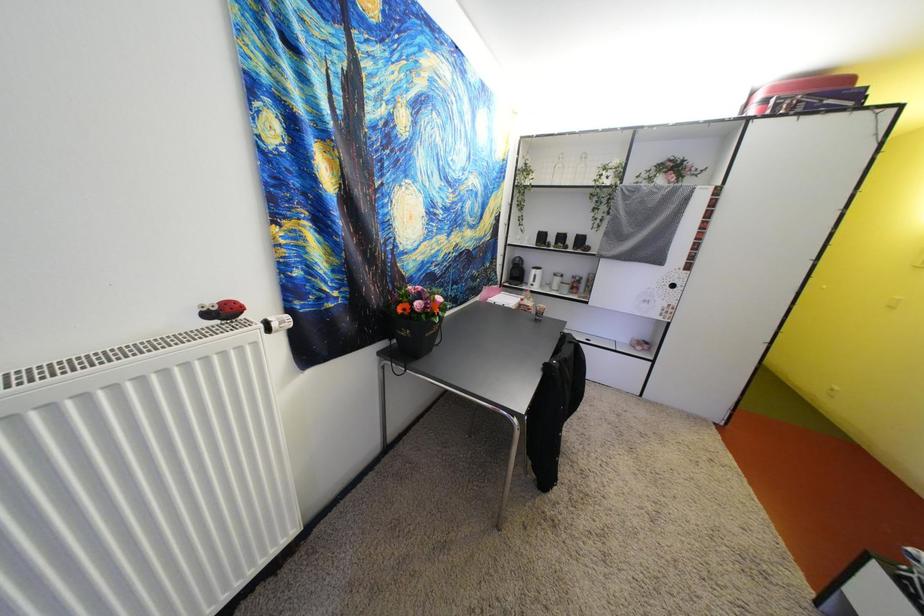
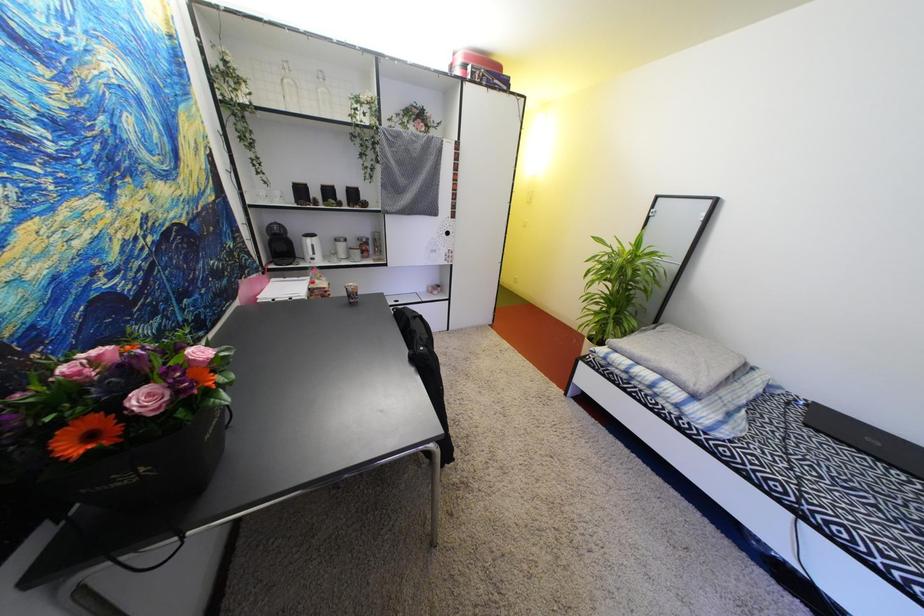
First-person continuous shooting, in which direction is the camera rotating?

The camera rotated toward right-down.